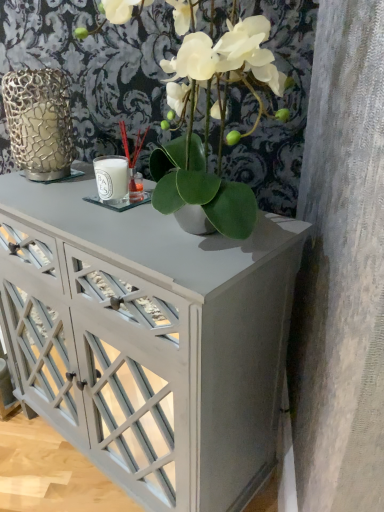
Question: Could you tell me if white glossy cabinet at center is facing green matte plant at center?

Choices:
 (A) no
 (B) yes

Answer: (A)

Question: Is green matte plant at center located within white glossy cabinet at center?

Choices:
 (A) no
 (B) yes

Answer: (A)

Question: From the image's perspective, is white glossy cabinet at center on green matte plant at center?

Choices:
 (A) no
 (B) yes

Answer: (A)

Question: Is white glossy cabinet at center not close to green matte plant at center?

Choices:
 (A) no
 (B) yes

Answer: (A)

Question: Is white glossy cabinet at center facing away from green matte plant at center?

Choices:
 (A) yes
 (B) no

Answer: (B)

Question: Considering the relative sizes of white glossy cabinet at center and green matte plant at center in the image provided, is white glossy cabinet at center wider than green matte plant at center?

Choices:
 (A) yes
 (B) no

Answer: (B)

Question: From a real-world perspective, is green matte plant at center over white glossy cabinet at center?

Choices:
 (A) yes
 (B) no

Answer: (A)

Question: Is green matte plant at center outside of white glossy cabinet at center?

Choices:
 (A) yes
 (B) no

Answer: (A)

Question: Considering the relative sizes of green matte plant at center and white glossy cabinet at center in the image provided, is green matte plant at center thinner than white glossy cabinet at center?

Choices:
 (A) no
 (B) yes

Answer: (A)

Question: From the image's perspective, is green matte plant at center on white glossy cabinet at center?

Choices:
 (A) yes
 (B) no

Answer: (A)

Question: From the image's perspective, does green matte plant at center appear lower than white glossy cabinet at center?

Choices:
 (A) yes
 (B) no

Answer: (B)

Question: Is there a large distance between green matte plant at center and white glossy cabinet at center?

Choices:
 (A) yes
 (B) no

Answer: (B)

Question: From a real-world perspective, is green matte plant at center located beneath gold textured vase at left?

Choices:
 (A) no
 (B) yes

Answer: (A)